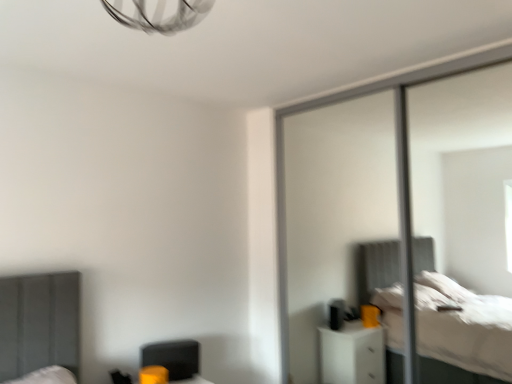
Find the location of a particular element. The height and width of the screenshot is (384, 512). matte black swivel chair at lower left is located at coordinates (173, 358).

What do you see at coordinates (173, 358) in the screenshot?
I see `matte black swivel chair at lower left` at bounding box center [173, 358].

Measure the distance between point (149, 351) and camera.

Point (149, 351) is 2.70 meters from camera.

This screenshot has height=384, width=512. What do you see at coordinates (334, 207) in the screenshot?
I see `transparent glass screen door at right` at bounding box center [334, 207].

Where is `transparent glass screen door at right`? transparent glass screen door at right is located at coordinates (334, 207).

From the picture: Measure the distance between transparent glass screen door at right and camera.

transparent glass screen door at right and camera are 8.16 feet apart from each other.

This screenshot has height=384, width=512. What are the coordinates of `matte black swivel chair at lower left` in the screenshot? It's located at (173, 358).

Considering the positions of objects matte black swivel chair at lower left and transparent glass screen door at right in the image provided, who is more to the right, matte black swivel chair at lower left or transparent glass screen door at right?

From the viewer's perspective, transparent glass screen door at right appears more on the right side.

Is the position of matte black swivel chair at lower left less distant than that of transparent glass screen door at right?

No, it is behind transparent glass screen door at right.

Considering the positions of point (187, 370) and point (421, 120), is point (187, 370) closer or farther from the camera than point (421, 120)?

Point (187, 370).

From the image's perspective, which object appears higher, matte black swivel chair at lower left or transparent glass screen door at right?

transparent glass screen door at right.

From a real-world perspective, who is located lower, matte black swivel chair at lower left or transparent glass screen door at right?

From a 3D spatial view, matte black swivel chair at lower left is below.

Which object is thinner, matte black swivel chair at lower left or transparent glass screen door at right?

matte black swivel chair at lower left is thinner.

Considering the sizes of objects matte black swivel chair at lower left and transparent glass screen door at right in the image provided, who is shorter, matte black swivel chair at lower left or transparent glass screen door at right?

matte black swivel chair at lower left is shorter.

Which of these two, matte black swivel chair at lower left or transparent glass screen door at right, is bigger?

transparent glass screen door at right is bigger.

Is matte black swivel chair at lower left spatially inside transparent glass screen door at right, or outside of it?

matte black swivel chair at lower left is not inside transparent glass screen door at right, it's outside.

Are matte black swivel chair at lower left and transparent glass screen door at right making contact?

No.

Is matte black swivel chair at lower left turned away from transparent glass screen door at right?

No, matte black swivel chair at lower left is not facing away from transparent glass screen door at right.

How much distance is there between matte black swivel chair at lower left and transparent glass screen door at right?

The distance of matte black swivel chair at lower left from transparent glass screen door at right is 7.65 feet.

Where is `swivel chair behind the transparent glass screen door at right`? swivel chair behind the transparent glass screen door at right is located at coordinates (173, 358).

Visually, is transparent glass screen door at right positioned to the left or to the right of matte black swivel chair at lower left?

Based on their positions, transparent glass screen door at right is located to the right of matte black swivel chair at lower left.

Is transparent glass screen door at right in front of or behind matte black swivel chair at lower left in the image?

transparent glass screen door at right is positioned closer to the viewer than matte black swivel chair at lower left.

Which is farther from the camera, (487, 118) or (185, 355)?

Point (487, 118)

From the image's perspective, which object appears higher, transparent glass screen door at right or matte black swivel chair at lower left?

transparent glass screen door at right appears higher in the image.

From a real-world perspective, is transparent glass screen door at right over matte black swivel chair at lower left?

Yes.

Looking at their sizes, would you say transparent glass screen door at right is wider or thinner than matte black swivel chair at lower left?

transparent glass screen door at right is wider than matte black swivel chair at lower left.

In terms of height, does transparent glass screen door at right look taller or shorter compared to matte black swivel chair at lower left?

Clearly, transparent glass screen door at right is taller compared to matte black swivel chair at lower left.

From the picture: Can you confirm if transparent glass screen door at right is bigger than matte black swivel chair at lower left?

Yes.

Is matte black swivel chair at lower left surrounded by transparent glass screen door at right?

No, matte black swivel chair at lower left is not a part of transparent glass screen door at right.

Does transparent glass screen door at right touch matte black swivel chair at lower left?

transparent glass screen door at right and matte black swivel chair at lower left are not in contact.

Is transparent glass screen door at right oriented away from matte black swivel chair at lower left?

No, transparent glass screen door at right is not facing the opposite direction of matte black swivel chair at lower left.

Can you tell me how much transparent glass screen door at right and matte black swivel chair at lower left differ in facing direction?

63.3 degrees.

Locate an element on the screen. Image resolution: width=512 pixels, height=384 pixels. screen door on the right of matte black swivel chair at lower left is located at coordinates (334, 207).

Find the location of a particular element. Image resolution: width=512 pixels, height=384 pixels. screen door in front of the matte black swivel chair at lower left is located at coordinates click(334, 207).

Where is `screen door that appears above the matte black swivel chair at lower left (from a real-world perspective)`? The height and width of the screenshot is (384, 512). screen door that appears above the matte black swivel chair at lower left (from a real-world perspective) is located at coordinates (334, 207).